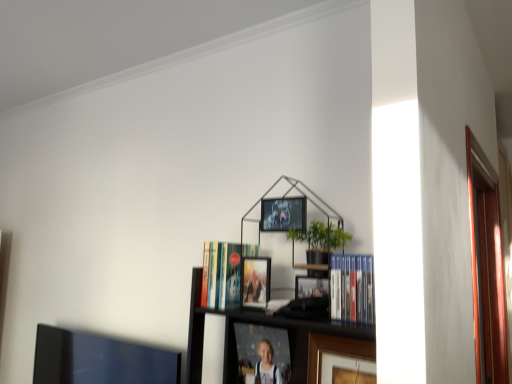
Question: Does hardcover book at center, the 1th book viewed from the left, turn towards gold-framed photo at center, which appears as the third picture frame when viewed from the top?

Choices:
 (A) yes
 (B) no

Answer: (B)

Question: Considering the relative sizes of hardcover book at center, positioned as the second book in front-to-back order, and gold-framed photo at center, which appears as the third picture frame when viewed from the top, in the image provided, is hardcover book at center, positioned as the second book in front-to-back order, thinner than gold-framed photo at center, which appears as the third picture frame when viewed from the top,?

Choices:
 (A) no
 (B) yes

Answer: (A)

Question: Can you confirm if hardcover book at center, the 1th book viewed from the left, is positioned to the left of gold-framed photo at center, acting as the second picture frame starting from the bottom?

Choices:
 (A) yes
 (B) no

Answer: (A)

Question: From the image's perspective, is hardcover book at center, arranged as the first book when viewed from the back, under gold-framed photo at center, which appears as the third picture frame when viewed from the top?

Choices:
 (A) yes
 (B) no

Answer: (B)

Question: Is hardcover book at center, arranged as the first book when viewed from the back, turned away from gold-framed photo at center, acting as the second picture frame starting from the bottom?

Choices:
 (A) yes
 (B) no

Answer: (B)

Question: Can you confirm if hardcover book at center, arranged as the first book when viewed from the back, is taller than gold-framed photo at center, which appears as the third picture frame when viewed from the top?

Choices:
 (A) no
 (B) yes

Answer: (A)

Question: Does matte plastic picture frame at center, the 1th picture frame in the bottom-to-top sequence, lie in front of blue hardcover books at center-right, which is the 2th book from left to right?

Choices:
 (A) no
 (B) yes

Answer: (A)

Question: Can you confirm if matte plastic picture frame at center, which is the 4th picture frame in top-to-bottom order, is smaller than blue hardcover books at center-right, which is the 2th book from left to right?

Choices:
 (A) yes
 (B) no

Answer: (B)

Question: Can you confirm if matte plastic picture frame at center, which is the 4th picture frame in top-to-bottom order, is positioned to the right of blue hardcover books at center-right, marked as the first book in a front-to-back arrangement?

Choices:
 (A) yes
 (B) no

Answer: (B)

Question: From the image's perspective, does matte plastic picture frame at center, the 1th picture frame in the bottom-to-top sequence, appear lower than blue hardcover books at center-right, marked as the first book in a front-to-back arrangement?

Choices:
 (A) no
 (B) yes

Answer: (B)

Question: Considering the relative positions of matte plastic picture frame at center, the 1th picture frame in the bottom-to-top sequence, and blue hardcover books at center-right, the first book from the right, in the image provided, is matte plastic picture frame at center, the 1th picture frame in the bottom-to-top sequence, behind blue hardcover books at center-right, the first book from the right,?

Choices:
 (A) yes
 (B) no

Answer: (A)

Question: Does matte plastic picture frame at center, the 1th picture frame in the bottom-to-top sequence, turn towards blue hardcover books at center-right, which is the 2th book from left to right?

Choices:
 (A) no
 (B) yes

Answer: (A)

Question: Is blue hardcover books at center-right, the first book from the right, oriented towards hardcover book at center, which is the 2th book in right-to-left order?

Choices:
 (A) no
 (B) yes

Answer: (A)